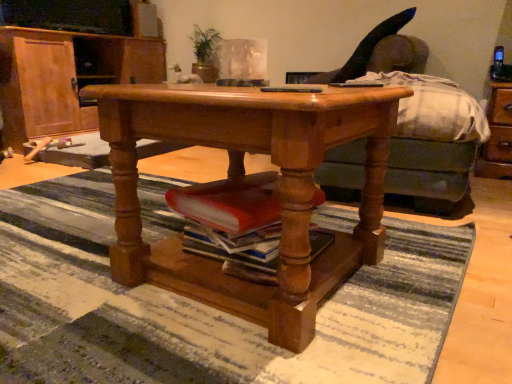
Question: Could you tell me if brown wooden dresser at right is turned towards green fabric couch at center?

Choices:
 (A) yes
 (B) no

Answer: (A)

Question: Could green fabric couch at center be considered to be inside brown wooden dresser at right?

Choices:
 (A) yes
 (B) no

Answer: (B)

Question: Is the position of brown wooden dresser at right less distant than that of green fabric couch at center?

Choices:
 (A) no
 (B) yes

Answer: (A)

Question: Is brown wooden dresser at right taller than green fabric couch at center?

Choices:
 (A) no
 (B) yes

Answer: (A)

Question: Does brown wooden dresser at right have a smaller size compared to green fabric couch at center?

Choices:
 (A) no
 (B) yes

Answer: (B)

Question: Is brown wooden dresser at right facing away from green fabric couch at center?

Choices:
 (A) yes
 (B) no

Answer: (B)

Question: Can you confirm if black plastic remote control at center is positioned to the right of green fabric couch at center?

Choices:
 (A) yes
 (B) no

Answer: (B)

Question: Is black plastic remote control at center in front of green fabric couch at center?

Choices:
 (A) yes
 (B) no

Answer: (A)

Question: Can you confirm if black plastic remote control at center is shorter than green fabric couch at center?

Choices:
 (A) yes
 (B) no

Answer: (A)

Question: From a real-world perspective, is black plastic remote control at center located higher than green fabric couch at center?

Choices:
 (A) no
 (B) yes

Answer: (B)

Question: From a real-world perspective, is black plastic remote control at center positioned under green fabric couch at center based on gravity?

Choices:
 (A) no
 (B) yes

Answer: (A)

Question: Does black plastic remote control at center have a lesser width compared to green fabric couch at center?

Choices:
 (A) yes
 (B) no

Answer: (A)

Question: Is black plastic remote control at center placed right next to green leafy plant at upper center?

Choices:
 (A) no
 (B) yes

Answer: (A)